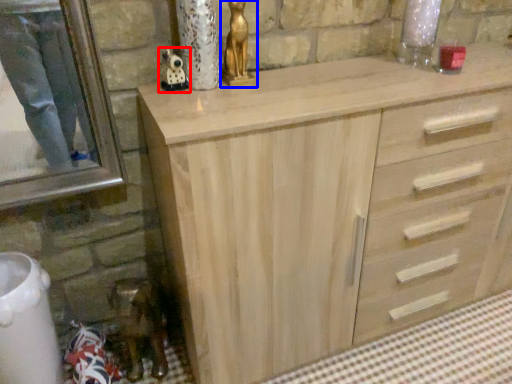
Question: Which object is closer to the camera taking this photo, miniature (highlighted by a red box) or sculpture (highlighted by a blue box)?

Choices:
 (A) miniature
 (B) sculpture

Answer: (B)